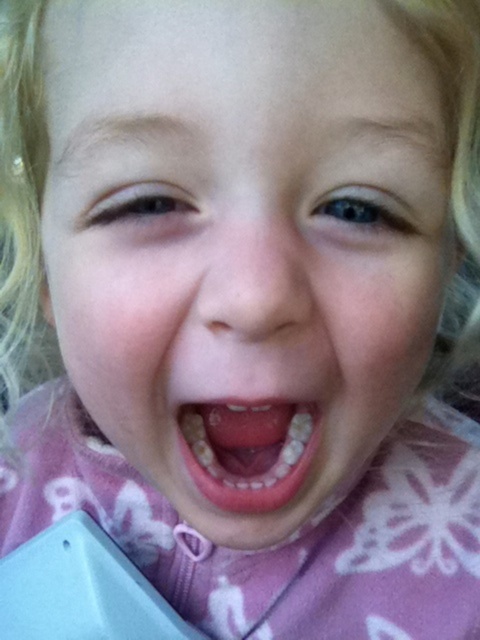
The child is holding a small toy that is 2 inches wide. If the child wants to place the toy between the pink fabric face at center and the light blue object at bottom left, will there be enough space?

The distance between the pink fabric face at center and the light blue object at bottom left is 8.02 inches. Since the toy is only 2 inches wide, there is sufficient space to place it between them.

You are a photographer trying to capture the child in the image. You notice the pink fabric face at center and the yellowish toothpaste at center. Which object is positioned to the right of the other?

The pink fabric face at center is to the right of yellowish toothpaste at center.

You are a dentist examining a child patient. You notice the pink fabric face at center and the yellowish toothpaste at center in the image. Which object is nearer to you?

The pink fabric face at center is closer to the viewer than the yellowish toothpaste at center.